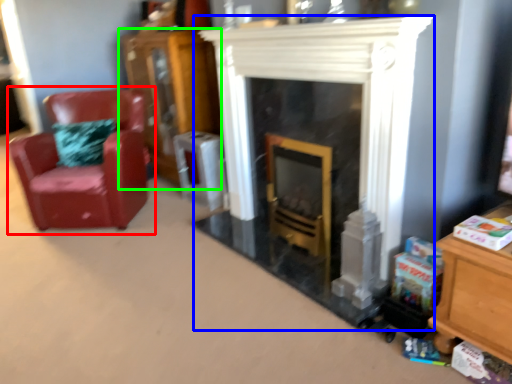
Question: Which is nearer to the chair (highlighted by a red box)? fireplace (highlighted by a blue box) or dresser (highlighted by a green box).

Choices:
 (A) fireplace
 (B) dresser

Answer: (B)